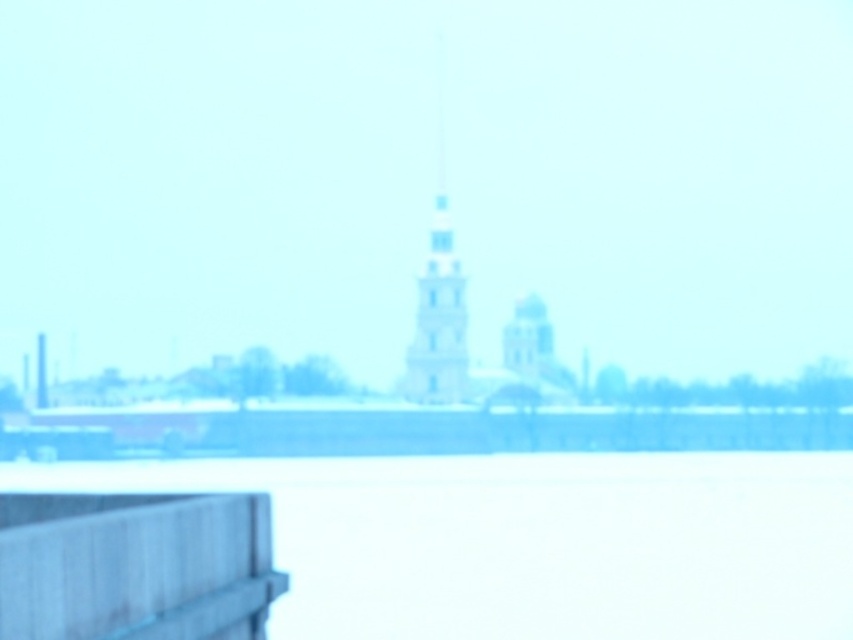
You are standing at the edge of a pier overlooking the water. You notice the white matte water at lower center and the gray wood rail at lower left. Which object is higher from the ground?

The white matte water at lower center is taller than the gray wood rail at lower left, so the white matte water at lower center is higher from the ground.

Based on the scene description and the coordinates provided, can you identify which object corresponds to the point at coordinates (534, 541)?

The point at coordinates (534, 541) corresponds to the white matte water at lower center.

You are a drone operator trying to capture a photo of the white stone tower at center from the white matte water at lower center. Given that your drone can only fly up to 100 feet, will you be able to reach the tower?

The distance between the white matte water at lower center and the white stone tower at center is 99.89 feet, which is just under the drone operator can fly the drone to capture the photo since the maximum distance is 100 feet.